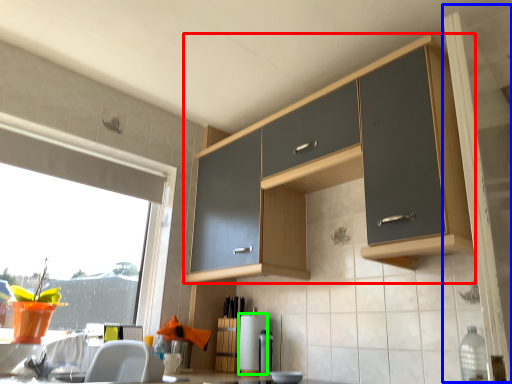
Question: Based on their relative distances, which object is farther from cabinetry (highlighted by a red box)? Choose from screen door (highlighted by a blue box) and appliance (highlighted by a green box).

Choices:
 (A) screen door
 (B) appliance

Answer: (B)